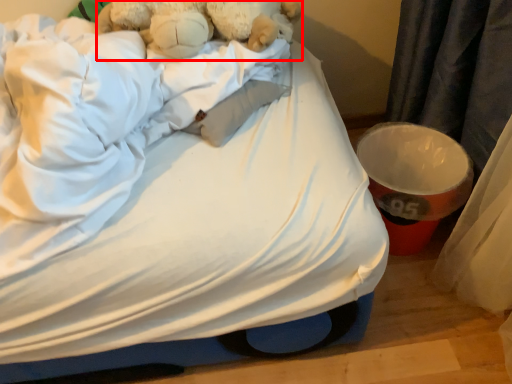
Question: Considering the relative positions of teddy bear (annotated by the red box) and bed in the image provided, where is teddy bear (annotated by the red box) located with respect to the staircase?

Choices:
 (A) left
 (B) right

Answer: (B)